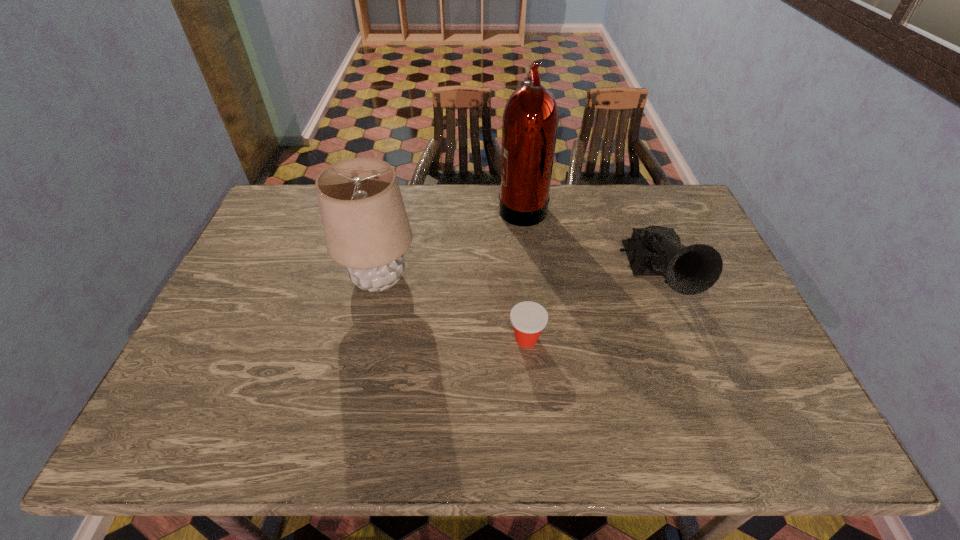
Find the location of `vacant space located 0.390m on the front-facing side of the farthest object`. vacant space located 0.390m on the front-facing side of the farthest object is located at coordinates (386, 206).

I want to click on vacant space located on the left of the lampshade, so click(254, 279).

Locate an element on the screen. free space located 0.090m from the horn of the rightmost object is located at coordinates (684, 352).

This screenshot has width=960, height=540. I want to click on blank area located on the left of the nearest object, so 377,339.

Identify the location of object that is positioned at the far edge. [530, 123].

Identify the location of object that is at the right edge. This screenshot has width=960, height=540. (655, 250).

This screenshot has height=540, width=960. In order to click on free spot at the far edge of the desktop in this screenshot , I will do `click(451, 201)`.

The width and height of the screenshot is (960, 540). Identify the location of free space at the near edge. (647, 441).

This screenshot has width=960, height=540. I want to click on free spot at the left edge of the desktop, so click(304, 227).

Find the location of a particular element. vacant point at the right edge is located at coordinates (723, 309).